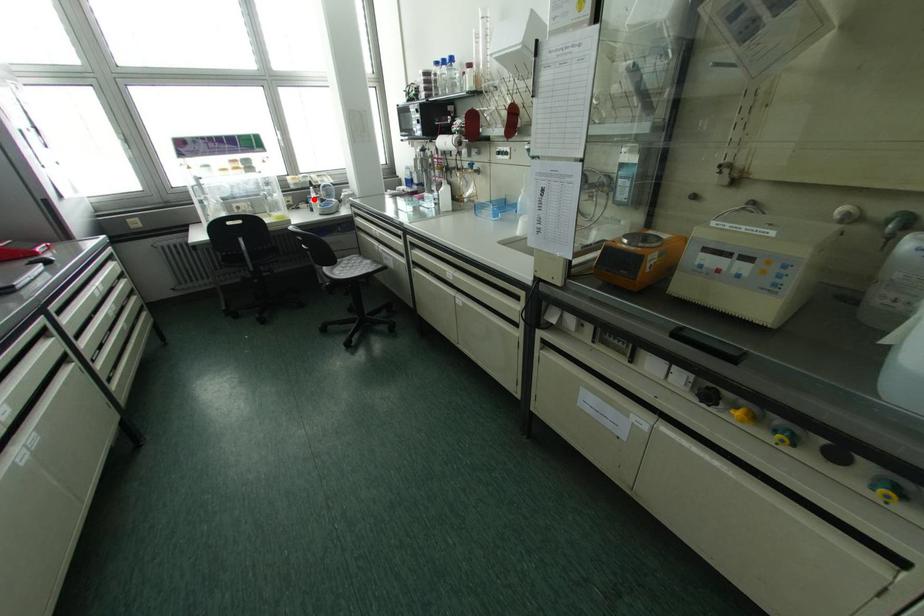
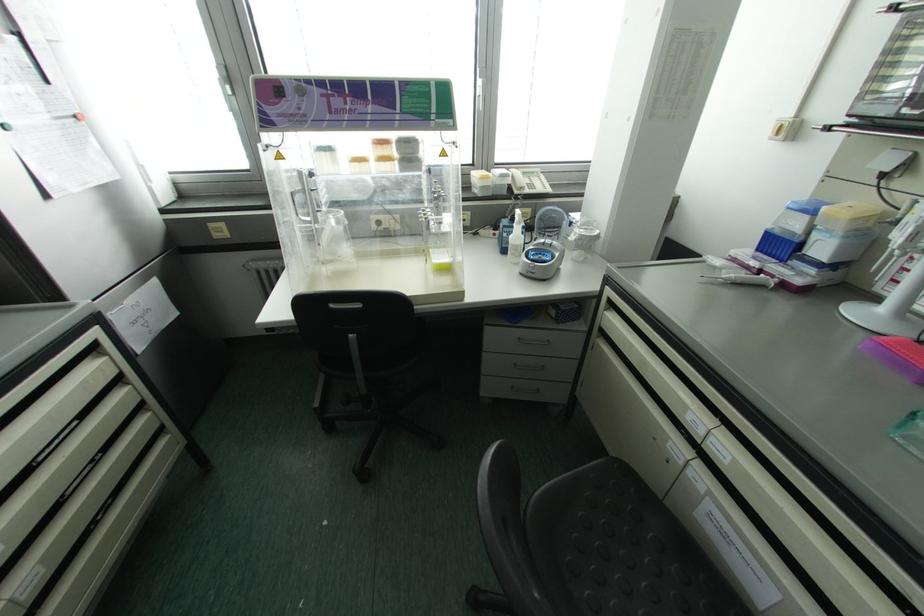
Question: I am providing you with two images of the same scene from different viewpoints. Given a red point in image1, look at the same physical point in image2. Is it:

Choices:
 (A) Closer to the viewpoint
 (B) Farther from the viewpoint

Answer: (B)